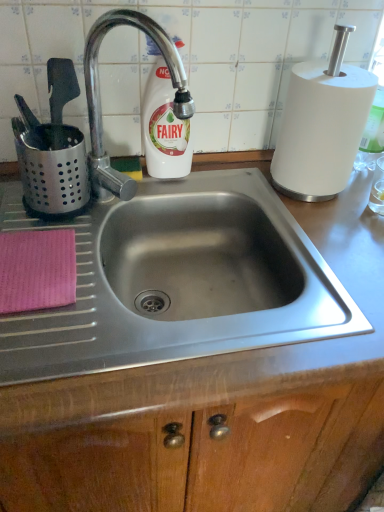
I want to click on white glossy bottle at upper center, so click(x=164, y=127).

Measure the distance between metallic stainless steel sink at center and camera.

The depth of metallic stainless steel sink at center is 19.14 inches.

Find the location of a particular element. pink woven cloth at lower left is located at coordinates (37, 270).

Where is `white glossy bottle at upper center`? white glossy bottle at upper center is located at coordinates (164, 127).

Considering the positions of objects white glossy bottle at upper center and white matte paper towel at upper right in the image provided, who is more to the left, white glossy bottle at upper center or white matte paper towel at upper right?

white glossy bottle at upper center.

From the image's perspective, would you say white glossy bottle at upper center is positioned over white matte paper towel at upper right?

No, from the image's perspective, white glossy bottle at upper center is not over white matte paper towel at upper right.

Does point (149, 163) come farther from viewer compared to point (284, 190)?

No, (149, 163) is closer to viewer.

In the scene shown: Would you say white glossy bottle at upper center is inside or outside pink woven cloth at lower left?

white glossy bottle at upper center is located beyond the bounds of pink woven cloth at lower left.

How different are the orientations of white glossy bottle at upper center and pink woven cloth at lower left in degrees?

white glossy bottle at upper center and pink woven cloth at lower left are facing 3 degrees away from each other.

I want to click on cloth located below the white glossy bottle at upper center (from the image's perspective), so click(37, 270).

Who is taller, white glossy bottle at upper center or pink woven cloth at lower left?

white glossy bottle at upper center is taller.

Considering the positions of points (101, 23) and (175, 130), is point (101, 23) closer to camera compared to point (175, 130)?

Yes, point (101, 23) is in front of point (175, 130).

Is polished metal faucet at upper left positioned far away from white glossy bottle at upper center?

No, there isn't a large distance between polished metal faucet at upper left and white glossy bottle at upper center.

Which object is wider, polished metal faucet at upper left or white glossy bottle at upper center?

Wider between the two is polished metal faucet at upper left.

Which object is closer to the camera, polished metal faucet at upper left or white glossy bottle at upper center?

polished metal faucet at upper left.

The image size is (384, 512). I want to click on tap above the pink woven cloth at lower left (from a real-world perspective), so click(x=100, y=97).

Is pink woven cloth at lower left thinner than polished metal faucet at upper left?

Incorrect, the width of pink woven cloth at lower left is not less than that of polished metal faucet at upper left.

Considering the sizes of pink woven cloth at lower left and polished metal faucet at upper left in the image, is pink woven cloth at lower left bigger or smaller than polished metal faucet at upper left?

Considering their sizes, pink woven cloth at lower left takes up less space than polished metal faucet at upper left.

Considering the relative positions of pink woven cloth at lower left and polished metal faucet at upper left in the image provided, is pink woven cloth at lower left to the right of polished metal faucet at upper left from the viewer's perspective?

Incorrect, pink woven cloth at lower left is not on the right side of polished metal faucet at upper left.

Which of these two, pink woven cloth at lower left or white glossy bottle at upper center, is bigger?

white glossy bottle at upper center.

This screenshot has width=384, height=512. Find the location of `cloth on the left of white glossy bottle at upper center`. cloth on the left of white glossy bottle at upper center is located at coordinates (37, 270).

From a real-world perspective, which is physically above, pink woven cloth at lower left or white glossy bottle at upper center?

From a 3D spatial view, white glossy bottle at upper center is above.

Can you confirm if pink woven cloth at lower left is thinner than white glossy bottle at upper center?

No.

Does pink woven cloth at lower left contain metallic stainless steel sink at center?

No, metallic stainless steel sink at center is not inside pink woven cloth at lower left.

From a real-world perspective, who is located higher, pink woven cloth at lower left or metallic stainless steel sink at center?

From a 3D spatial view, pink woven cloth at lower left is above.

Which object is further away from the camera, pink woven cloth at lower left or metallic stainless steel sink at center?

pink woven cloth at lower left is behind.

Measure the distance between pink woven cloth at lower left and metallic stainless steel sink at center.

Answer: A distance of 14.56 inches exists between pink woven cloth at lower left and metallic stainless steel sink at center.

Based on the photo, from a real-world perspective, which object rests below the other?

metallic stainless steel sink at center.

Is metallic stainless steel sink at center aimed at polished metal faucet at upper left?

No, metallic stainless steel sink at center does not turn towards polished metal faucet at upper left.

Does metallic stainless steel sink at center have a larger size compared to polished metal faucet at upper left?

Indeed, metallic stainless steel sink at center has a larger size compared to polished metal faucet at upper left.

Where is `cleaning product on the left of white matte paper towel at upper right`? The image size is (384, 512). cleaning product on the left of white matte paper towel at upper right is located at coordinates (164, 127).

Locate an element on the screen. cloth below the white glossy bottle at upper center (from the image's perspective) is located at coordinates (37, 270).

Estimate the real-world distances between objects in this image. Which object is closer to white matte paper towel at upper right, metallic stainless steel sink at center or pink woven cloth at lower left?

The object closer to white matte paper towel at upper right is metallic stainless steel sink at center.

Considering their positions, is white matte paper towel at upper right positioned closer to white glossy bottle at upper center than pink woven cloth at lower left?

Among the two, white matte paper towel at upper right is located nearer to white glossy bottle at upper center.

Looking at the image, which one is located closer to pink woven cloth at lower left, white matte paper towel at upper right or metallic stainless steel sink at center?

The object closer to pink woven cloth at lower left is metallic stainless steel sink at center.

Considering their positions, is polished metal faucet at upper left positioned further to pink woven cloth at lower left than white glossy bottle at upper center?

white glossy bottle at upper center is positioned further to the anchor pink woven cloth at lower left.

Considering their positions, is white glossy bottle at upper center positioned further to pink woven cloth at lower left than polished metal faucet at upper left?

white glossy bottle at upper center is further to pink woven cloth at lower left.

From the image, which object appears to be nearer to metallic stainless steel sink at center, pink woven cloth at lower left or white matte paper towel at upper right?

Based on the image, white matte paper towel at upper right appears to be nearer to metallic stainless steel sink at center.

Based on their spatial positions, is metallic stainless steel sink at center or pink woven cloth at lower left closer to white glossy bottle at upper center?

pink woven cloth at lower left lies closer to white glossy bottle at upper center than the other object.

From the picture: Based on their spatial positions, is white glossy bottle at upper center or pink woven cloth at lower left further from white matte paper towel at upper right?

Among the two, pink woven cloth at lower left is located further to white matte paper towel at upper right.

Where is `cloth between white glossy bottle at upper center and metallic stainless steel sink at center vertically`? Image resolution: width=384 pixels, height=512 pixels. cloth between white glossy bottle at upper center and metallic stainless steel sink at center vertically is located at coordinates (37, 270).

Where is `cleaning product between white matte paper towel at upper right and metallic stainless steel sink at center vertically`? The width and height of the screenshot is (384, 512). cleaning product between white matte paper towel at upper right and metallic stainless steel sink at center vertically is located at coordinates (164, 127).

In order to click on cleaning product located between polished metal faucet at upper left and white matte paper towel at upper right in the left-right direction in this screenshot , I will do (x=164, y=127).

The height and width of the screenshot is (512, 384). Find the location of `tap that lies between white glossy bottle at upper center and metallic stainless steel sink at center from top to bottom`. tap that lies between white glossy bottle at upper center and metallic stainless steel sink at center from top to bottom is located at coordinates coord(100,97).